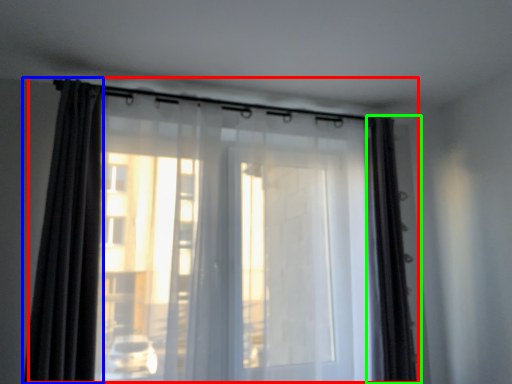
Question: Estimate the real-world distances between objects in this image. Which object is farther from curtain (highlighted by a red box), curtain (highlighted by a blue box) or curtain (highlighted by a green box)?

Choices:
 (A) curtain
 (B) curtain

Answer: (B)